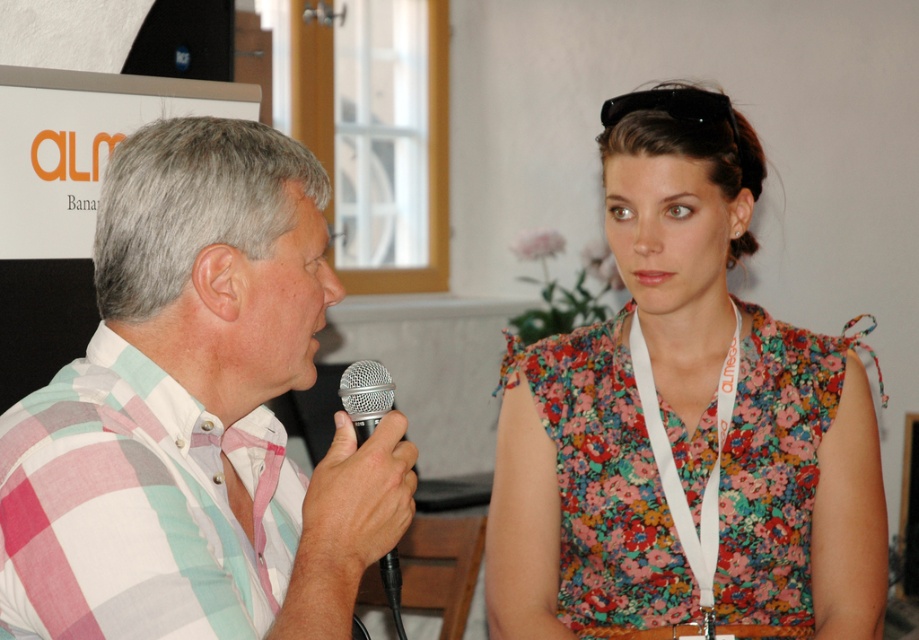
You are organizing a photo shoot and need to ensure that the checkered fabric shirt at left and the silver metallic microphone at center are visible in the frame. Based on their sizes, which object should you prioritize positioning closer to the camera to maintain clarity?

The checkered fabric shirt at left is wider than the silver metallic microphone at center, so you should prioritize positioning the checkered fabric shirt at left closer to the camera to maintain clarity.

You are standing in the room and see the point at coordinates (194, 413). What object is located at that point?

The point at coordinates (194, 413) corresponds to the checkered fabric shirt at left.